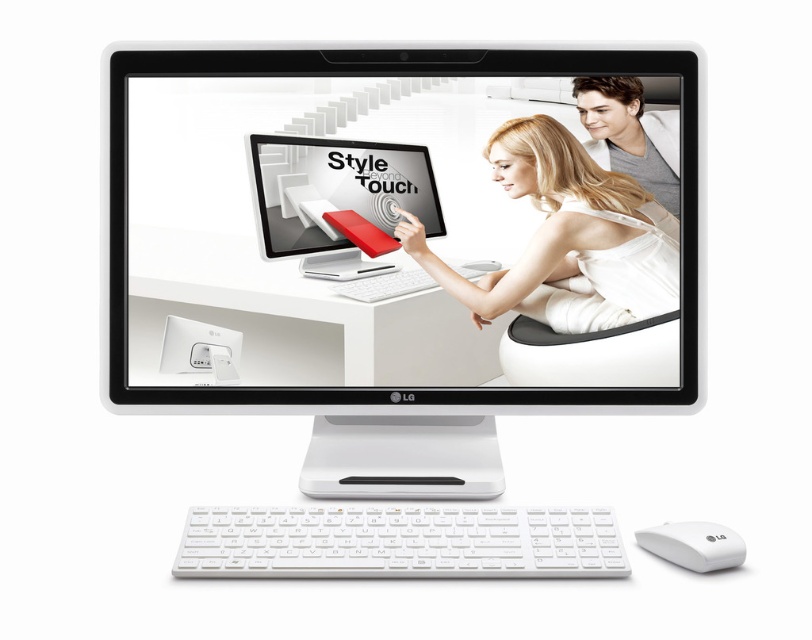
Question: Which object appears closest to the camera in this image?

Choices:
 (A) white plastic keyboard at lower center
 (B) smooth white shirt at upper right
 (C) matte plastic monitor at center
 (D) white plastic mouse at lower right

Answer: (A)

Question: Can you confirm if matte plastic monitor at center is bigger than smooth white shirt at upper right?

Choices:
 (A) yes
 (B) no

Answer: (A)

Question: Which point appears closest to the camera in this image?

Choices:
 (A) (206, 156)
 (B) (581, 163)
 (C) (715, 541)

Answer: (C)

Question: Does white glossy monitor at center appear over matte plastic monitor at center?

Choices:
 (A) no
 (B) yes

Answer: (A)

Question: Is white glossy monitor at center smaller than white plastic mouse at lower right?

Choices:
 (A) yes
 (B) no

Answer: (B)

Question: Which object appears closest to the camera in this image?

Choices:
 (A) smooth white shirt at upper right
 (B) smooth white woman at center

Answer: (A)